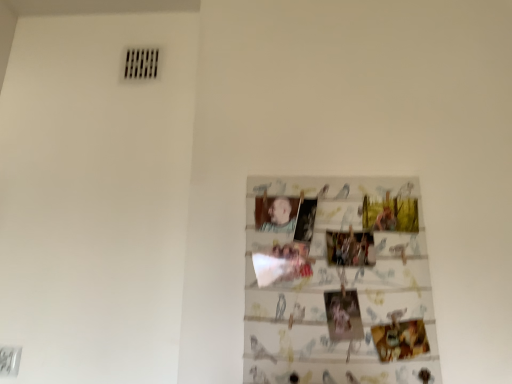
Describe the element at coordinates (340, 285) in the screenshot. I see `printed paper collage at center` at that location.

Locate an element on the screen. The width and height of the screenshot is (512, 384). printed paper collage at center is located at coordinates (340, 285).

The height and width of the screenshot is (384, 512). Describe the element at coordinates (276, 213) in the screenshot. I see `smooth skin portrait at center` at that location.

What is the approximate height of smooth skin portrait at center?

smooth skin portrait at center is 4.22 inches in height.

Where is `smooth skin portrait at center`? This screenshot has width=512, height=384. smooth skin portrait at center is located at coordinates (276, 213).

Where is `printed paper collage at center`? printed paper collage at center is located at coordinates (340, 285).

Based on their positions, is printed paper collage at center located to the left or right of smooth skin portrait at center?

Based on their positions, printed paper collage at center is located to the right of smooth skin portrait at center.

Considering their positions, is printed paper collage at center located in front of or behind smooth skin portrait at center?

printed paper collage at center is in front of smooth skin portrait at center.

Does point (398, 286) appear closer or farther from the camera than point (265, 216)?

Clearly, point (398, 286) is closer to the camera than point (265, 216).

From the image's perspective, which object appears higher, printed paper collage at center or smooth skin portrait at center?

smooth skin portrait at center is shown above in the image.

From a real-world perspective, is printed paper collage at center on smooth skin portrait at center?

No, from a real-world perspective, printed paper collage at center is not on top of smooth skin portrait at center.

Does printed paper collage at center have a lesser width compared to smooth skin portrait at center?

In fact, printed paper collage at center might be wider than smooth skin portrait at center.

Considering the sizes of objects printed paper collage at center and smooth skin portrait at center in the image provided, who is shorter, printed paper collage at center or smooth skin portrait at center?

With less height is smooth skin portrait at center.

Does printed paper collage at center have a smaller size compared to smooth skin portrait at center?

Incorrect, printed paper collage at center is not smaller in size than smooth skin portrait at center.

Looking at this image, is printed paper collage at center situated inside smooth skin portrait at center or outside?

printed paper collage at center is not enclosed by smooth skin portrait at center.

Is printed paper collage at center next to smooth skin portrait at center and touching it?

No, printed paper collage at center is not next to smooth skin portrait at center.

Is printed paper collage at center oriented towards smooth skin portrait at center?

Yes, printed paper collage at center is aimed at smooth skin portrait at center.

Measure the distance from printed paper collage at center to smooth skin portrait at center.

printed paper collage at center and smooth skin portrait at center are 9.08 inches apart from each other.

This screenshot has width=512, height=384. What are the coordinates of `person behind the printed paper collage at center` in the screenshot? It's located at (276, 213).

Is smooth skin portrait at center at the left side of printed paper collage at center?

Correct, you'll find smooth skin portrait at center to the left of printed paper collage at center.

Is smooth skin portrait at center closer to the viewer compared to printed paper collage at center?

No, smooth skin portrait at center is behind printed paper collage at center.

Which is behind, point (271, 212) or point (420, 316)?

The point (271, 212) is farther from the camera.

From the image's perspective, between smooth skin portrait at center and printed paper collage at center, who is located below?

From the image's view, printed paper collage at center is below.

From a real-world perspective, is smooth skin portrait at center on printed paper collage at center?

Yes, from a real-world perspective, smooth skin portrait at center is on top of printed paper collage at center.

Which object is wider, smooth skin portrait at center or printed paper collage at center?

printed paper collage at center.

Between smooth skin portrait at center and printed paper collage at center, which one has more height?

printed paper collage at center.

Considering the sizes of objects smooth skin portrait at center and printed paper collage at center in the image provided, who is bigger, smooth skin portrait at center or printed paper collage at center?

printed paper collage at center is bigger.

Do you think smooth skin portrait at center is within printed paper collage at center, or outside of it?

smooth skin portrait at center is located beyond the bounds of printed paper collage at center.

Is smooth skin portrait at center with printed paper collage at center?

smooth skin portrait at center and printed paper collage at center are not in contact.

Is smooth skin portrait at center facing away from printed paper collage at center?

Yes, smooth skin portrait at center is positioned with its back facing printed paper collage at center.

How far apart are smooth skin portrait at center and printed paper collage at center?

A distance of 9.08 inches exists between smooth skin portrait at center and printed paper collage at center.

Locate an element on the screen. The height and width of the screenshot is (384, 512). print that is below the smooth skin portrait at center (from the image's perspective) is located at coordinates (340, 285).

This screenshot has width=512, height=384. What are the coordinates of `person on the left of printed paper collage at center` in the screenshot? It's located at (276, 213).

There is a printed paper collage at center. At what (x,y) coordinates should I click in order to perform the action: click on person above it (from a real-world perspective). Please return your answer as a coordinate pair (x, y). Image resolution: width=512 pixels, height=384 pixels. Looking at the image, I should click on (276, 213).